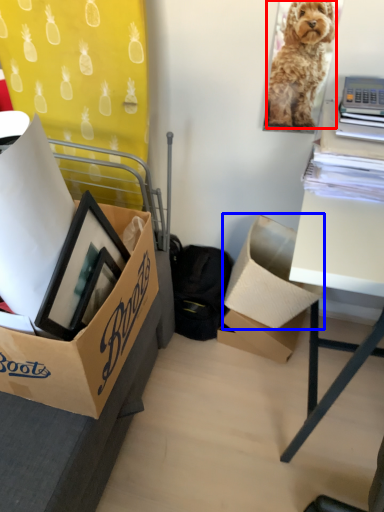
Question: Which object is closer to the camera taking this photo, dog (highlighted by a red box) or box (highlighted by a blue box)?

Choices:
 (A) dog
 (B) box

Answer: (A)